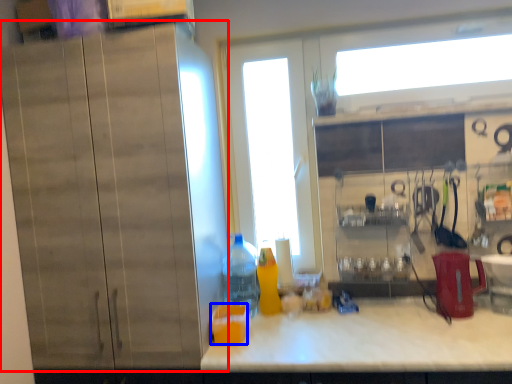
Question: Which object appears closest to the camera in this image, cabinetry (highlighted by a red box) or juice (highlighted by a blue box)?

Choices:
 (A) cabinetry
 (B) juice

Answer: (A)